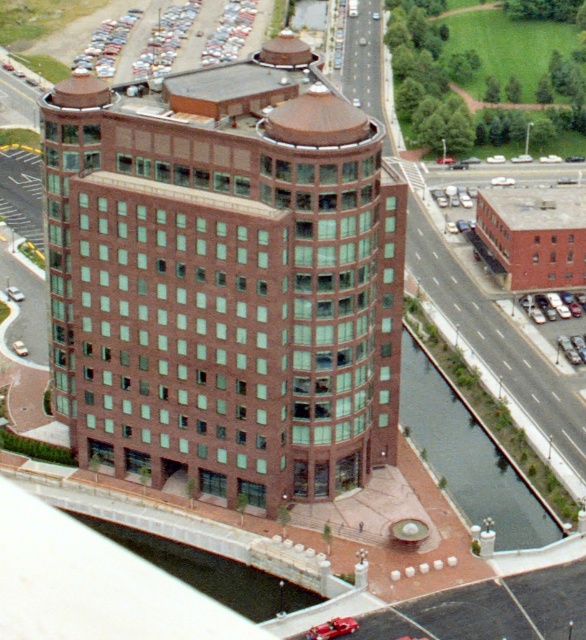
Question: Is brown brick building at center below shiny red car at lower center?

Choices:
 (A) no
 (B) yes

Answer: (A)

Question: Observing the image, what is the correct spatial positioning of metallic silver car at right in reference to shiny red car at lower center?

Choices:
 (A) left
 (B) right

Answer: (B)

Question: Estimate the real-world distances between objects in this image. Which object is closer to the shiny red car at lower center?

Choices:
 (A) metallic silver car at right
 (B) brown brick building at center

Answer: (B)

Question: Which object is the farthest from the shiny red car at lower center?

Choices:
 (A) metallic silver car at right
 (B) brown brick building at center

Answer: (A)

Question: Which point appears closest to the camera in this image?

Choices:
 (A) (328, 632)
 (B) (178, 364)

Answer: (A)

Question: Is brown brick building at center closer to the viewer compared to shiny red car at lower center?

Choices:
 (A) no
 (B) yes

Answer: (A)